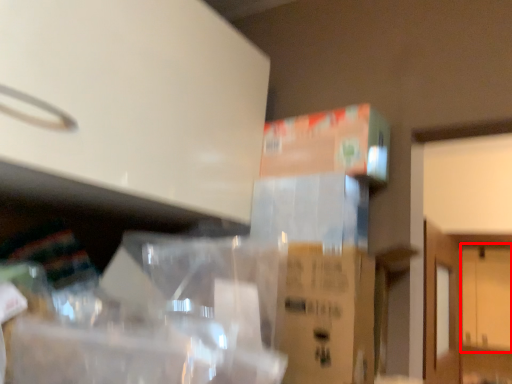
Question: From the image, what is the correct spatial relationship of door (annotated by the red box) in relation to cardboard box?

Choices:
 (A) right
 (B) left

Answer: (A)